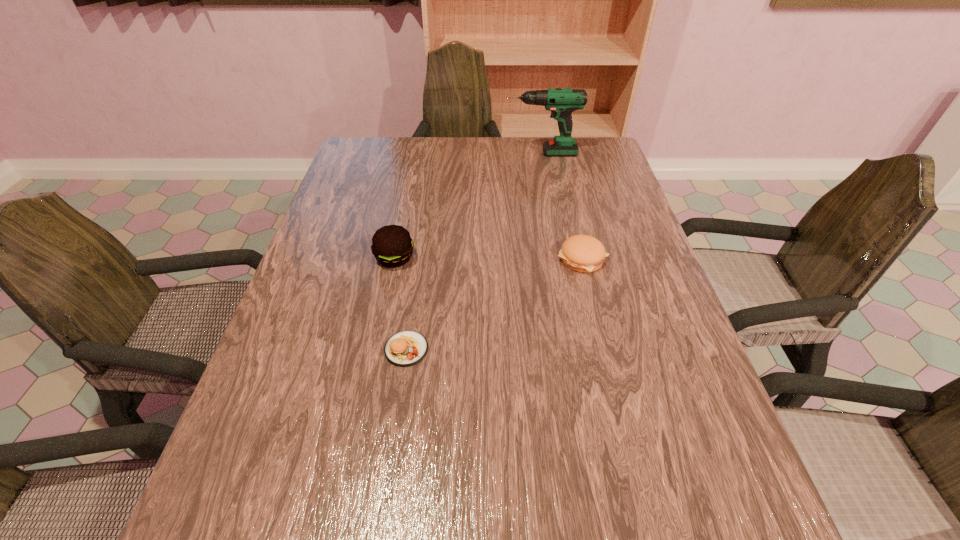
Locate an element on the screen. This screenshot has width=960, height=540. vacant space at the right edge is located at coordinates (631, 332).

At what (x,y) coordinates should I click in order to perform the action: click on free space at the far left corner. Please return your answer as a coordinate pair (x, y). Image resolution: width=960 pixels, height=540 pixels. Looking at the image, I should click on (369, 162).

In the image, there is a desktop. Where is `vacant region at the far right corner`? vacant region at the far right corner is located at coordinates (576, 172).

You are a GUI agent. You are given a task and a screenshot of the screen. Output one action in this format:
    pyautogui.click(x=<x>, y=<y>)
    Task: Click on the vacant point located between the rightmost patty and the tallest patty
    
    Given the screenshot: What is the action you would take?
    pyautogui.click(x=489, y=259)

The height and width of the screenshot is (540, 960). I want to click on free space that is in between the rightmost patty and the drill, so click(562, 206).

The width and height of the screenshot is (960, 540). Identify the location of empty space that is in between the nearest patty and the rightmost patty. (494, 304).

Locate an element on the screen. The height and width of the screenshot is (540, 960). empty space between the farthest object and the rightmost patty is located at coordinates (562, 206).

I want to click on free area in between the rightmost patty and the second tallest object, so click(x=489, y=259).

Locate an element on the screen. vacant area that lies between the tallest patty and the nearest object is located at coordinates (400, 303).

Find the location of `free spot between the farthest object and the nearest object`. free spot between the farthest object and the nearest object is located at coordinates (473, 251).